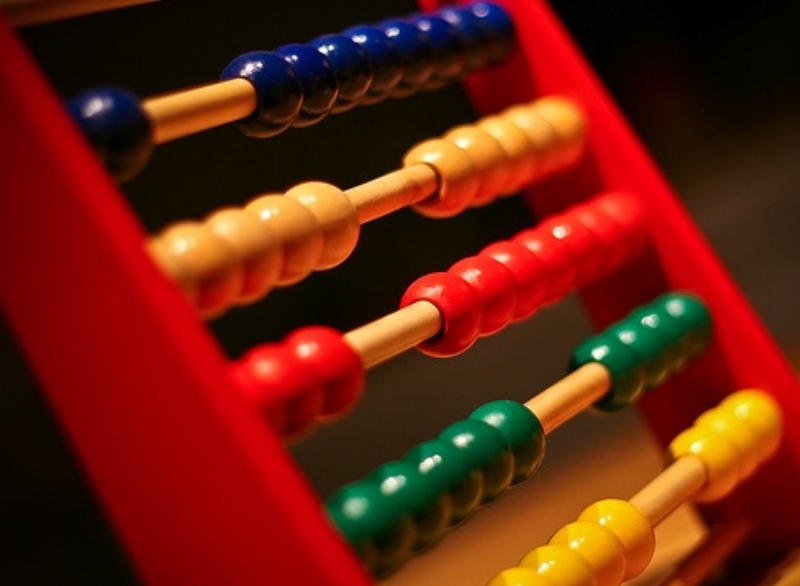
Where is `green abacus beads`? green abacus beads is located at coordinates (366, 533), (394, 519), (420, 503), (452, 476), (496, 456), (525, 441), (616, 354), (644, 340), (672, 332), (693, 316).